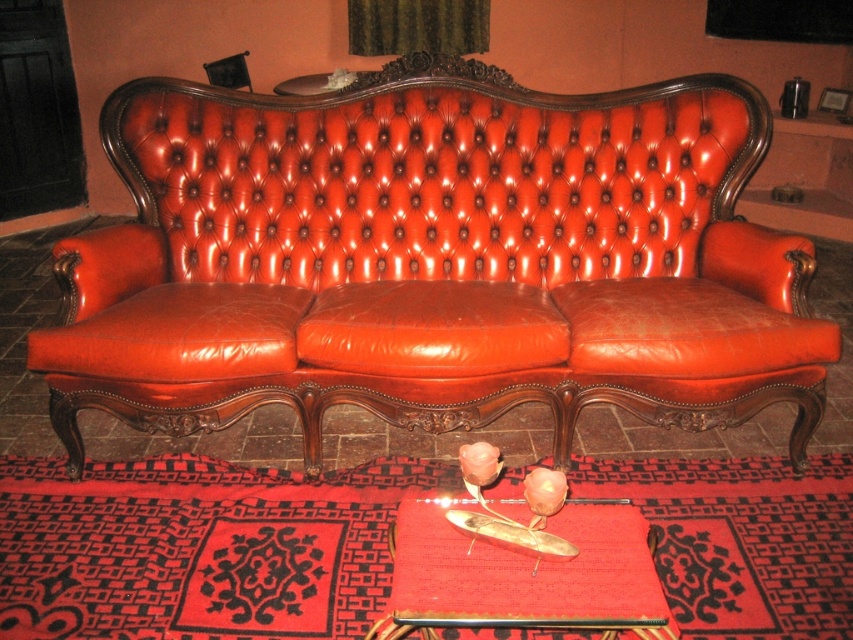
Can you confirm if shiny leather couch at center is positioned to the left of smooth leather pad at center?

Indeed, shiny leather couch at center is positioned on the left side of smooth leather pad at center.

Does point (740, 96) lie in front of point (595, 582)?

No, it is not.

Which is in front, point (148, 157) or point (561, 595)?

Point (561, 595) is more forward.

At what (x,y) coordinates should I click in order to perform the action: click on shiny leather couch at center. Please return your answer as a coordinate pair (x, y). Looking at the image, I should click on (434, 259).